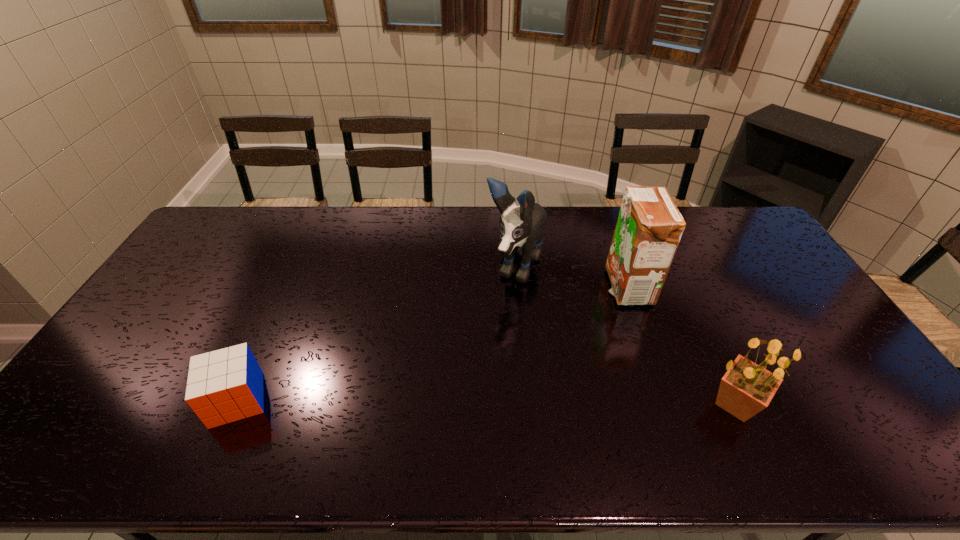
In order to click on the shortest object in this screenshot , I will do `click(226, 385)`.

The height and width of the screenshot is (540, 960). Find the location of `the leftmost object`. the leftmost object is located at coordinates (226, 385).

Locate an element on the screen. the rightmost object is located at coordinates (747, 388).

I want to click on the second shortest object, so click(x=747, y=388).

This screenshot has width=960, height=540. Identify the location of carton. (649, 227).

Locate an element on the screen. This screenshot has width=960, height=540. the second object from right to left is located at coordinates (649, 227).

Image resolution: width=960 pixels, height=540 pixels. In order to click on the second object from left to right in this screenshot , I will do `click(521, 228)`.

The width and height of the screenshot is (960, 540). I want to click on puppy, so click(x=521, y=228).

Identify the location of blank space located on the back of the cube. (295, 272).

At what (x,y) coordinates should I click in order to perform the action: click on vacant space located 0.220m at the front of the second shortest object with flowers visible. Please return your answer as a coordinate pair (x, y). The height and width of the screenshot is (540, 960). Looking at the image, I should click on (852, 404).